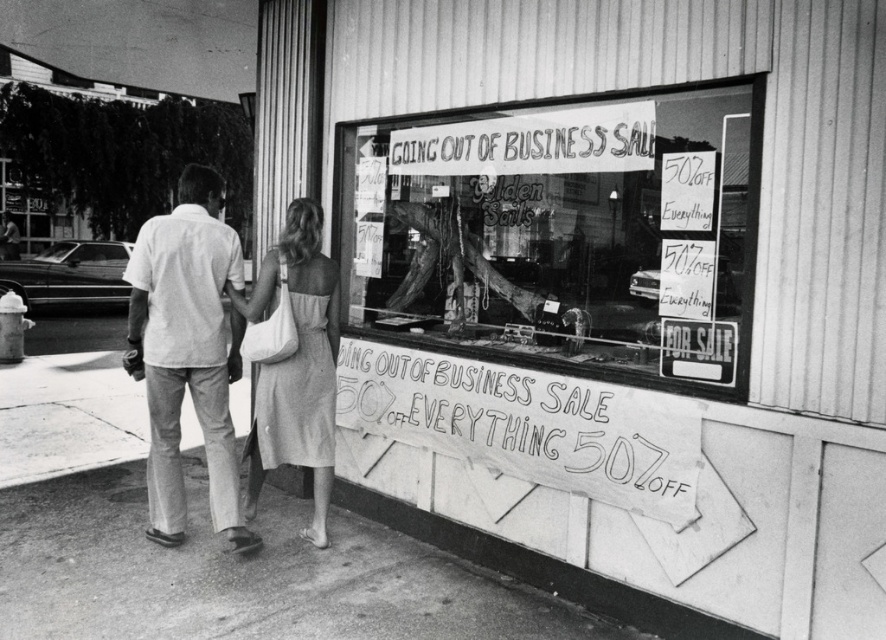
You are a customer looking at the store from the sidewalk. You see the paper signs at center and the white handwritten sign at upper center. Which sign is closer to your right side?

The paper signs at center is to the right of white handwritten sign at upper center, so the paper signs at center is closer to your right side.

You are a customer looking at the storefront. There are two signs you notice immediately. The first is the paper signs at center and the second is the white handwritten sign at upper center. Which sign is located above the other?

The white handwritten sign at upper center is above the paper signs at center because the paper signs at center is positioned under it.

You are standing on the sidewalk in front of the store. There is a point marked at coordinates (x=565, y=236). What object is located at this point?

The point at coordinates (x=565, y=236) indicates the transparent glass window at center.